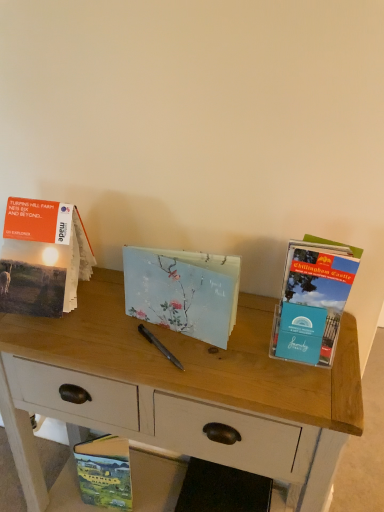
In order to click on wooden desk at center in this screenshot , I will do `click(182, 390)`.

Considering the positions of points (137, 265) and (62, 281), is point (137, 265) closer to camera compared to point (62, 281)?

That is True.

From a real-world perspective, is light blue textured notebook at center, the second book positioned from the top, above or below matte paper book at left, which appears as the first book when viewed from the top?

Clearly, from a real-world perspective, light blue textured notebook at center, the second book positioned from the top, is below matte paper book at left, which appears as the first book when viewed from the top.

Is matte paper book at left, which appears as the fourth book when ordered from the bottom, located within light blue textured notebook at center, the 2th book when ordered from right to left?

Definitely not — matte paper book at left, which appears as the fourth book when ordered from the bottom, is not inside light blue textured notebook at center, the 2th book when ordered from right to left.

Which is in front, light blue textured notebook at center, the 2th book when ordered from right to left, or matte paper book at left, which appears as the first book when viewed from the top?

Positioned in front is light blue textured notebook at center, the 2th book when ordered from right to left.

Locate an element on the screen. This screenshot has height=512, width=384. the 3rd book counting from the left side of the blue cardstock brochure at right, which is counted as the first book, starting from the right is located at coordinates (42, 257).

Between matte paper book at left, acting as the 4th book starting from the right, and blue cardstock brochure at right, the fourth book from the left, which one has more height?

With more height is matte paper book at left, acting as the 4th book starting from the right.

Is matte paper book at left, which appears as the fourth book when ordered from the bottom, situated inside blue cardstock brochure at right, which is the 2th book from bottom to top, or outside?

matte paper book at left, which appears as the fourth book when ordered from the bottom, is located beyond the bounds of blue cardstock brochure at right, which is the 2th book from bottom to top.

From a real-world perspective, which is physically above, light blue textured notebook at center, marked as the third book in a left-to-right arrangement, or hardcover book at lower left, the 3th book from the right?

From a 3D spatial view, light blue textured notebook at center, marked as the third book in a left-to-right arrangement, is above.

Is light blue textured notebook at center, the 2th book when ordered from right to left, spatially inside hardcover book at lower left, the 3th book from the right, or outside of it?

light blue textured notebook at center, the 2th book when ordered from right to left, is located beyond the bounds of hardcover book at lower left, the 3th book from the right.

From the image's perspective, who appears lower, light blue textured notebook at center, the second book positioned from the top, or hardcover book at lower left, the 3th book from the right?

hardcover book at lower left, the 3th book from the right.

Does light blue textured notebook at center, marked as the third book in a left-to-right arrangement, touch hardcover book at lower left, arranged as the 4th book when viewed from the top?

No, light blue textured notebook at center, marked as the third book in a left-to-right arrangement, is not in contact with hardcover book at lower left, arranged as the 4th book when viewed from the top.

Between blue cardstock brochure at right, the fourth book from the left, and hardcover book at lower left, arranged as the 4th book when viewed from the top, which one is positioned in front?

blue cardstock brochure at right, the fourth book from the left, is in front.

Is blue cardstock brochure at right, which appears as the third book when viewed from the top, smaller than hardcover book at lower left, which appears as the 2th book when viewed from the left?

No, blue cardstock brochure at right, which appears as the third book when viewed from the top, is not smaller than hardcover book at lower left, which appears as the 2th book when viewed from the left.

Considering the relative sizes of blue cardstock brochure at right, the fourth book from the left, and hardcover book at lower left, which is counted as the first book, starting from the bottom, in the image provided, is blue cardstock brochure at right, the fourth book from the left, thinner than hardcover book at lower left, which is counted as the first book, starting from the bottom,?

No.

In the scene shown: Is blue cardstock brochure at right, which appears as the third book when viewed from the top, facing towards hardcover book at lower left, which is counted as the first book, starting from the bottom?

No, blue cardstock brochure at right, which appears as the third book when viewed from the top, is not oriented towards hardcover book at lower left, which is counted as the first book, starting from the bottom.

Which is correct: wooden desk at center is inside matte paper book at left, which appears as the first book when viewed from the top, or outside of it?

wooden desk at center is located beyond the bounds of matte paper book at left, which appears as the first book when viewed from the top.

From a real-world perspective, is wooden desk at center physically located above or below matte paper book at left, which appears as the first book when viewed from the top?

wooden desk at center is situated lower than matte paper book at left, which appears as the first book when viewed from the top, in the real world.

Is wooden desk at center positioned before matte paper book at left, which appears as the fourth book when ordered from the bottom?

That is True.

From the image's perspective, is wooden desk at center beneath light blue textured notebook at center, the 2th book when ordered from right to left?

Yes.

In the scene shown: Could you tell me if wooden desk at center is turned towards light blue textured notebook at center, the 2th book when ordered from right to left?

No, wooden desk at center is not oriented towards light blue textured notebook at center, the 2th book when ordered from right to left.

Are wooden desk at center and light blue textured notebook at center, the 2th book when ordered from right to left, beside each other?

wooden desk at center is not next to light blue textured notebook at center, the 2th book when ordered from right to left, and they're not touching.

Is wooden desk at center smaller than light blue textured notebook at center, the 2th book when ordered from right to left?

Actually, wooden desk at center might be larger than light blue textured notebook at center, the 2th book when ordered from right to left.

Based on the photo, can blue cardstock brochure at right, which is counted as the first book, starting from the right, be found inside hardcover book at lower left, which is counted as the first book, starting from the bottom?

No, hardcover book at lower left, which is counted as the first book, starting from the bottom, does not contain blue cardstock brochure at right, which is counted as the first book, starting from the right.

Looking at their sizes, would you say hardcover book at lower left, the 3th book from the right, is wider or thinner than blue cardstock brochure at right, which appears as the third book when viewed from the top?

hardcover book at lower left, the 3th book from the right, is thinner than blue cardstock brochure at right, which appears as the third book when viewed from the top.

Looking at this image, from a real-world perspective, is hardcover book at lower left, arranged as the 4th book when viewed from the top, located higher than blue cardstock brochure at right, which appears as the third book when viewed from the top?

Incorrect, from a real-world perspective, hardcover book at lower left, arranged as the 4th book when viewed from the top, is lower than blue cardstock brochure at right, which appears as the third book when viewed from the top.

Is hardcover book at lower left, the 3th book from the right, facing towards blue cardstock brochure at right, which is counted as the first book, starting from the right?

No, hardcover book at lower left, the 3th book from the right, is not aimed at blue cardstock brochure at right, which is counted as the first book, starting from the right.

I want to click on book that is the 2nd one when counting rightward from the matte paper book at left, which appears as the fourth book when ordered from the bottom, so click(x=183, y=291).

You are a GUI agent. You are given a task and a screenshot of the screen. Output one action in this format:
    pyautogui.click(x=<x>, y=<y>)
    Task: Click on the book that is the 2nd object located below the matte paper book at left, which appears as the first book when viewed from the top (from the image's perspective)
    This screenshot has width=384, height=512.
    Given the screenshot: What is the action you would take?
    pyautogui.click(x=313, y=298)

Considering their positions, is hardcover book at lower left, which is counted as the first book, starting from the bottom, positioned further to light blue textured notebook at center, marked as the third book in a left-to-right arrangement, than blue cardstock brochure at right, the fourth book from the left?

hardcover book at lower left, which is counted as the first book, starting from the bottom, is further to light blue textured notebook at center, marked as the third book in a left-to-right arrangement.

Looking at the image, which one is located further to light blue textured notebook at center, marked as the third book in a left-to-right arrangement, wooden desk at center or matte paper book at left, the first book in the left-to-right sequence?

The object further to light blue textured notebook at center, marked as the third book in a left-to-right arrangement, is matte paper book at left, the first book in the left-to-right sequence.

Looking at the image, which one is located closer to wooden desk at center, light blue textured notebook at center, the second book positioned from the top, or matte paper book at left, acting as the 4th book starting from the right?

Among the two, light blue textured notebook at center, the second book positioned from the top, is located nearer to wooden desk at center.

Considering their positions, is wooden desk at center positioned further to hardcover book at lower left, which appears as the 2th book when viewed from the left, than blue cardstock brochure at right, the fourth book from the left?

blue cardstock brochure at right, the fourth book from the left, is further to hardcover book at lower left, which appears as the 2th book when viewed from the left.

Looking at the image, which one is located further to hardcover book at lower left, arranged as the 4th book when viewed from the top, wooden desk at center or matte paper book at left, which appears as the fourth book when ordered from the bottom?

Among the two, matte paper book at left, which appears as the fourth book when ordered from the bottom, is located further to hardcover book at lower left, arranged as the 4th book when viewed from the top.

From the image, which object appears to be farther from matte paper book at left, which appears as the fourth book when ordered from the bottom, blue cardstock brochure at right, which is the 2th book from bottom to top, or wooden desk at center?

blue cardstock brochure at right, which is the 2th book from bottom to top, lies further to matte paper book at left, which appears as the fourth book when ordered from the bottom, than the other object.

Estimate the real-world distances between objects in this image. Which object is further from blue cardstock brochure at right, which is counted as the first book, starting from the right, wooden desk at center or matte paper book at left, which appears as the fourth book when ordered from the bottom?

matte paper book at left, which appears as the fourth book when ordered from the bottom, lies further to blue cardstock brochure at right, which is counted as the first book, starting from the right, than the other object.

Looking at the image, which one is located further to matte paper book at left, the first book in the left-to-right sequence, wooden desk at center or light blue textured notebook at center, which is the 3th book from bottom to top?

The object further to matte paper book at left, the first book in the left-to-right sequence, is wooden desk at center.

Locate an element on the screen. desk between matte paper book at left, which appears as the fourth book when ordered from the bottom, and blue cardstock brochure at right, the fourth book from the left, in the horizontal direction is located at coordinates (182, 390).

Find the location of a particular element. book between light blue textured notebook at center, the second book positioned from the top, and wooden desk at center in the up-down direction is located at coordinates (313, 298).

Find the location of a particular element. The image size is (384, 512). desk that lies between light blue textured notebook at center, the 2th book when ordered from right to left, and hardcover book at lower left, which appears as the 2th book when viewed from the left, from top to bottom is located at coordinates (182, 390).

At what (x,y) coordinates should I click in order to perform the action: click on desk between matte paper book at left, acting as the 4th book starting from the right, and hardcover book at lower left, the 3th book from the right, in the up-down direction. Please return your answer as a coordinate pair (x, y). Image resolution: width=384 pixels, height=512 pixels. Looking at the image, I should click on (182, 390).